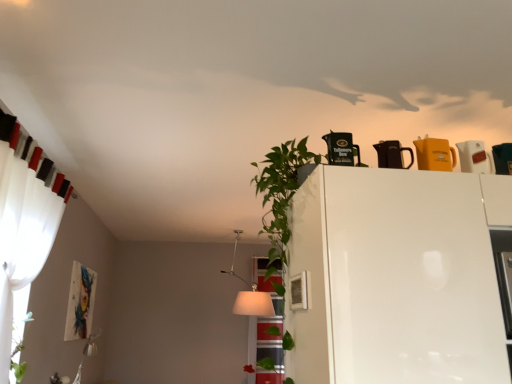
Question: Considering the relative sizes of white glossy fridge at upper center and white sheer curtain at left in the image provided, is white glossy fridge at upper center taller than white sheer curtain at left?

Choices:
 (A) yes
 (B) no

Answer: (B)

Question: Is white glossy fridge at upper center touching white sheer curtain at left?

Choices:
 (A) yes
 (B) no

Answer: (B)

Question: Is white glossy fridge at upper center aimed at white sheer curtain at left?

Choices:
 (A) yes
 (B) no

Answer: (B)

Question: Can you confirm if white glossy fridge at upper center is shorter than white sheer curtain at left?

Choices:
 (A) yes
 (B) no

Answer: (A)

Question: Does white glossy fridge at upper center have a lesser width compared to white sheer curtain at left?

Choices:
 (A) yes
 (B) no

Answer: (B)

Question: Is black plastic coffee pot at upper center, arranged as the 4th appliance when viewed from the right, to the left or to the right of translucent glass window at center in the image?

Choices:
 (A) right
 (B) left

Answer: (A)

Question: Do you think black plastic coffee pot at upper center, arranged as the 4th appliance when viewed from the right, is within translucent glass window at center, or outside of it?

Choices:
 (A) inside
 (B) outside

Answer: (B)

Question: Considering the positions of point (349, 152) and point (258, 332), is point (349, 152) closer or farther from the camera than point (258, 332)?

Choices:
 (A) farther
 (B) closer

Answer: (B)

Question: In terms of width, does black plastic coffee pot at upper center, which is the first appliance in left-to-right order, look wider or thinner when compared to translucent glass window at center?

Choices:
 (A) wide
 (B) thin

Answer: (B)

Question: From the image's perspective, is white fabric lampshade at center positioned above or below white sheer curtain at left?

Choices:
 (A) below
 (B) above

Answer: (A)

Question: Based on their sizes in the image, would you say white fabric lampshade at center is bigger or smaller than white sheer curtain at left?

Choices:
 (A) big
 (B) small

Answer: (A)

Question: From a real-world perspective, relative to white sheer curtain at left, is white fabric lampshade at center vertically above or below?

Choices:
 (A) above
 (B) below

Answer: (A)

Question: Is white fabric lampshade at center in front of or behind white sheer curtain at left in the image?

Choices:
 (A) behind
 (B) front

Answer: (A)

Question: Considering their positions, is translucent glass window at center located in front of or behind matte black kettle at upper center, which is counted as the 2th appliance, starting from the left?

Choices:
 (A) behind
 (B) front

Answer: (A)

Question: Is point (280, 355) closer or farther from the camera than point (387, 155)?

Choices:
 (A) closer
 (B) farther

Answer: (B)